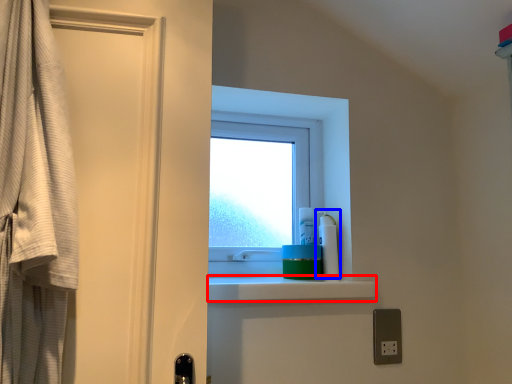
Question: Which object appears closest to the camera in this image, balustrade (highlighted by a red box) or cleaning product (highlighted by a blue box)?

Choices:
 (A) balustrade
 (B) cleaning product

Answer: (A)